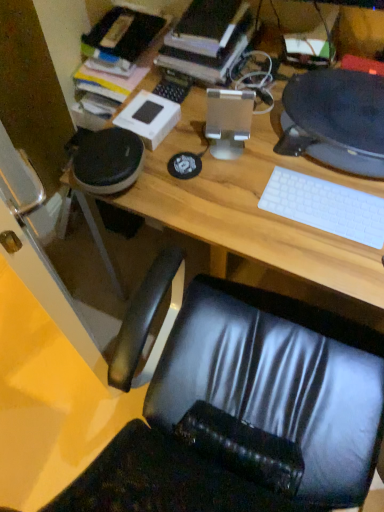
Where is `blank space above matte black desktop computer at upper right, which appears as the first desktop computer when viewed from the right (from a real-world perspective)`? blank space above matte black desktop computer at upper right, which appears as the first desktop computer when viewed from the right (from a real-world perspective) is located at coordinates (343, 101).